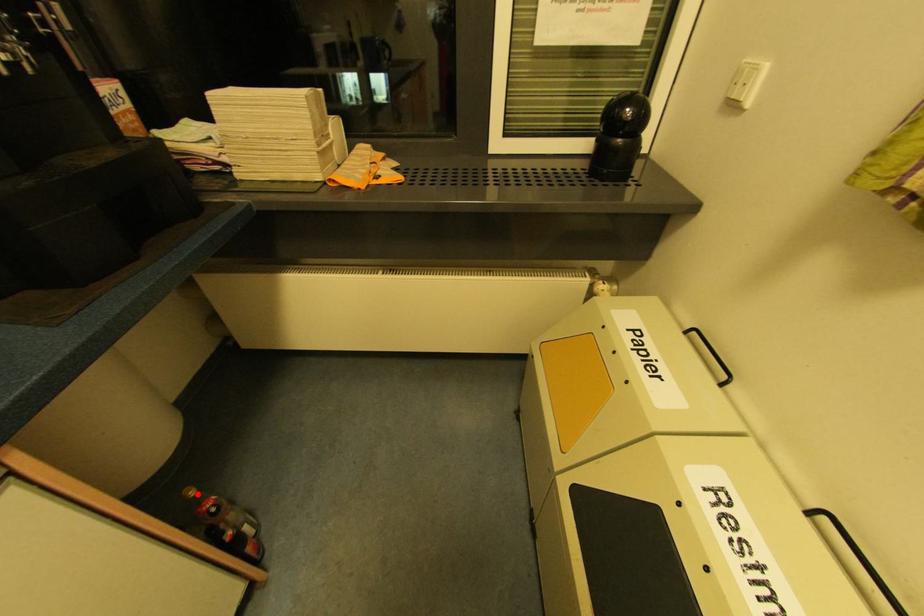
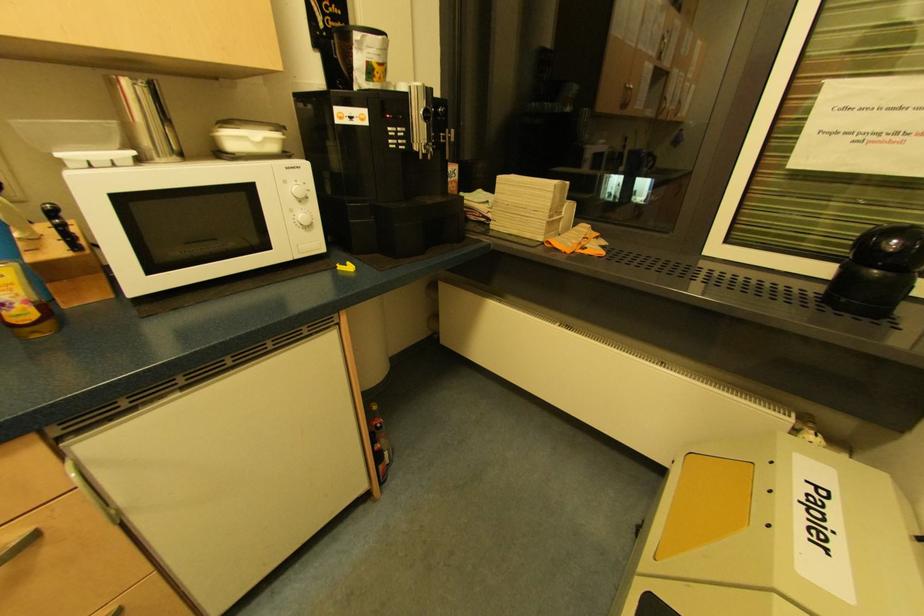
Question: A red point is marked in image1. In image2, is the corresponding 3D point closer to the camera or farther? Reply with the corresponding letter.

Choices:
 (A) The corresponding 3D point is closer.
 (B) The corresponding 3D point is farther.

Answer: (A)